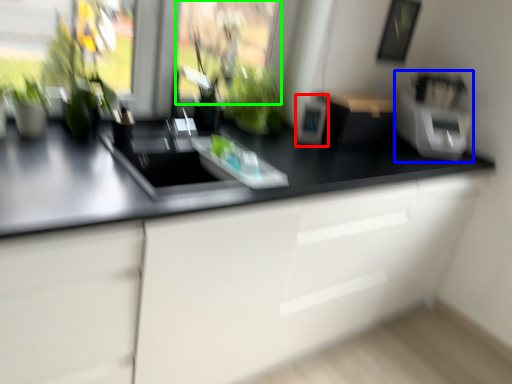
Question: Estimate the real-world distances between objects in this image. Which object is farther from appliance (highlighted by a red box), appliance (highlighted by a blue box) or window screen (highlighted by a green box)?

Choices:
 (A) appliance
 (B) window screen

Answer: (A)